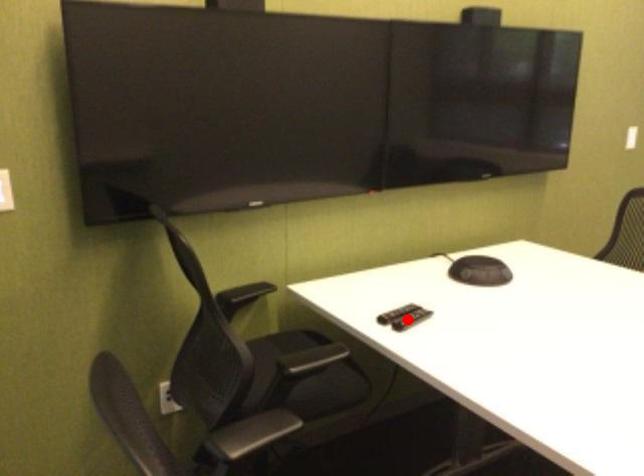
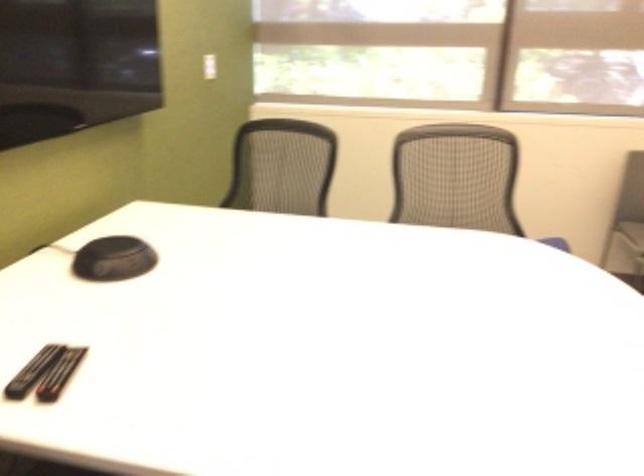
Question: I am providing you with two images of the same scene from different viewpoints. Image1 has a red point marked. In image2, the corresponding 3D location appears at what relative position? Reply with the corresponding letter.

Choices:
 (A) Closer
 (B) Farther

Answer: (A)